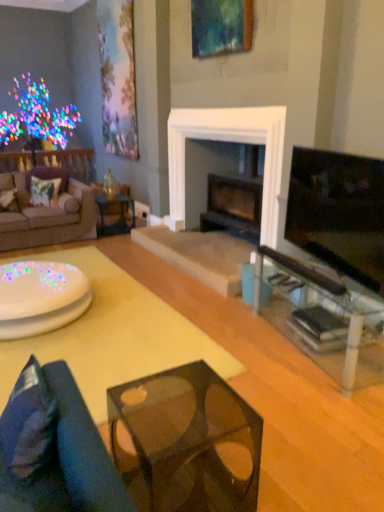
Find the location of a particular element. vacant area that is situated to the right of translucent glass cube at center, the second table in the right-to-left sequence is located at coordinates (278, 468).